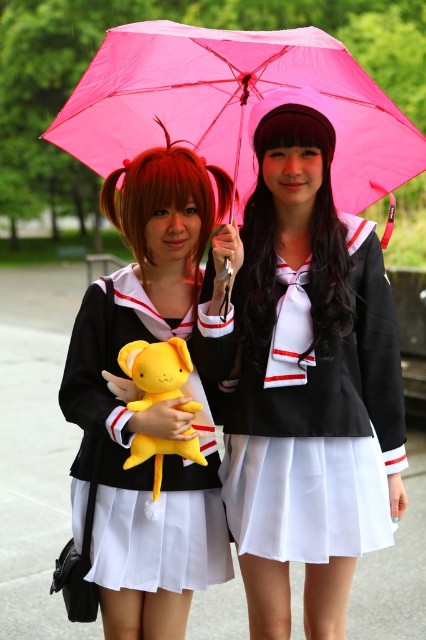
You are a photographer at a school event and need to capture a clear photo of both the matte black dress at center and the yellow plush toy at center. Based on their positions, which object should you focus on first to ensure both are in focus?

The yellow plush toy at center is behind the matte black dress at center, so you should focus on the matte black dress at center first to ensure both are in focus.

You are a photographer trying to capture a clear shot of the matte black dress at center and the pink fabric umbrella at upper center. Since you want to focus on the dress, which object should you position closer to the camera?

The matte black dress at center is thinner than the pink fabric umbrella at upper center, so you should position the matte black dress at center closer to the camera to ensure it appears in focus while the umbrella might be slightly blurred due to its larger size.